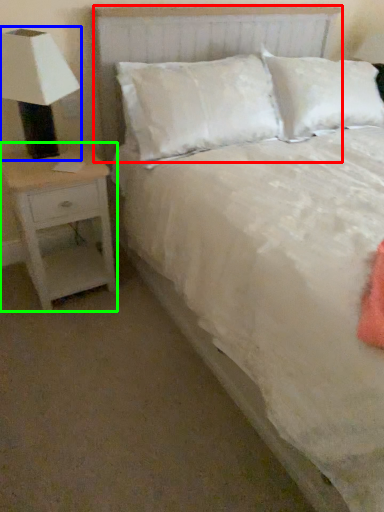
Question: Based on their relative distances, which object is nearer to headboard (highlighted by a red box)? Choose from lamp (highlighted by a blue box) and nightstand (highlighted by a green box).

Choices:
 (A) lamp
 (B) nightstand

Answer: (A)